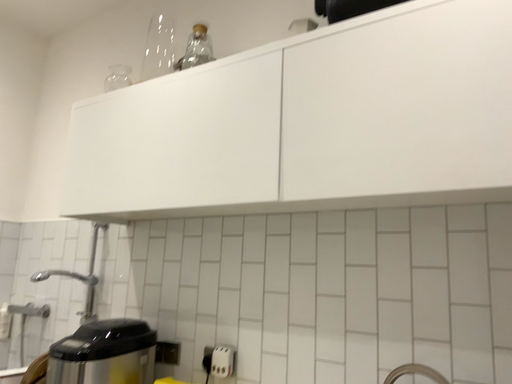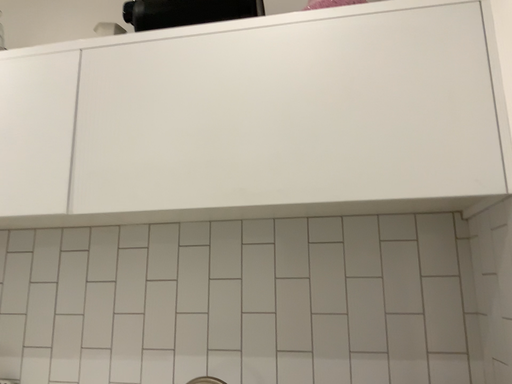
Question: Which way did the camera rotate in the video?

Choices:
 (A) rotated left
 (B) rotated right

Answer: (B)